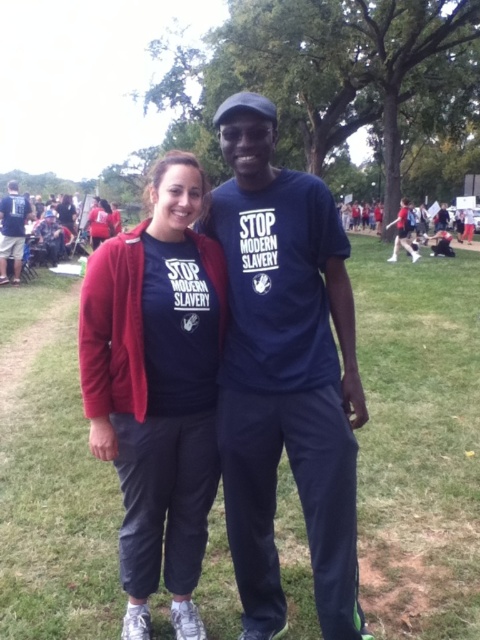
Question: Considering the relative positions of matte blue t-shirt at center and matte black t-shirt at left in the image provided, where is matte blue t-shirt at center located with respect to matte black t-shirt at left?

Choices:
 (A) below
 (B) above

Answer: (A)

Question: Which of the following is the closest to the observer?

Choices:
 (A) matte black t-shirt at left
 (B) navy blue t-shirt at center
 (C) matte blue t-shirt at center

Answer: (B)

Question: Among these objects, which one is farthest from the camera?

Choices:
 (A) navy blue t-shirt at center
 (B) matte black t-shirt at left
 (C) matte blue t-shirt at center

Answer: (B)

Question: Which point is closer to the camera?

Choices:
 (A) (19, 253)
 (B) (311, 536)
 (C) (112, 317)

Answer: (B)

Question: Can you confirm if navy blue t-shirt at center is wider than matte blue t-shirt at center?

Choices:
 (A) no
 (B) yes

Answer: (A)

Question: Is matte blue t-shirt at center above matte black t-shirt at left?

Choices:
 (A) yes
 (B) no

Answer: (B)